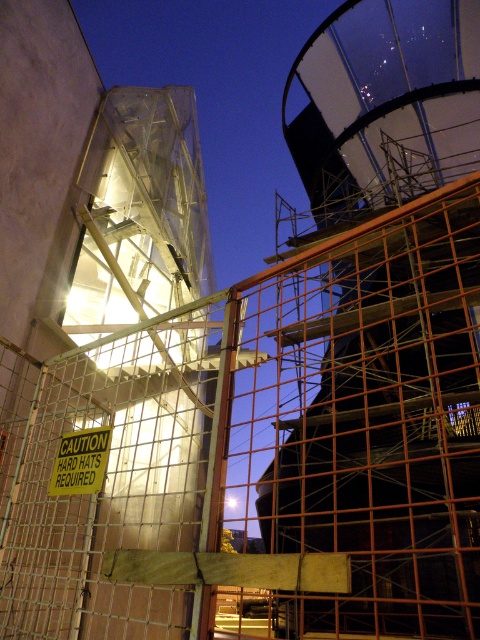
Question: Which point is closer to the camera?

Choices:
 (A) (88, 488)
 (B) (60, 371)

Answer: (A)

Question: Which point is closer to the camera?

Choices:
 (A) (68, 476)
 (B) (469, 561)

Answer: (A)

Question: Is metal grid fence at center wider than yellow paper sign at center?

Choices:
 (A) yes
 (B) no

Answer: (A)

Question: Can you confirm if metal grid fence at center is thinner than yellow paper sign at center?

Choices:
 (A) yes
 (B) no

Answer: (B)

Question: Can you confirm if metal grid fence at center is smaller than yellow paper sign at center?

Choices:
 (A) no
 (B) yes

Answer: (A)

Question: Which point is farther to the camera?

Choices:
 (A) metal grid fence at center
 (B) yellow paper sign at center

Answer: (B)